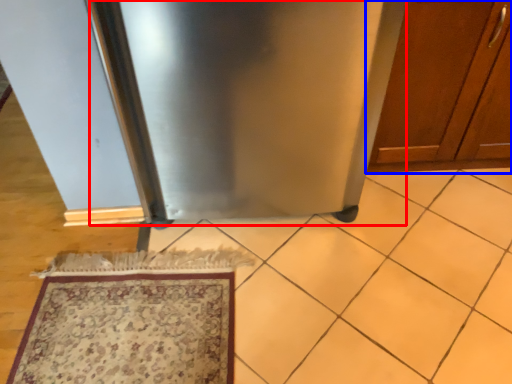
Question: Which point is further to the camera, appliance (highlighted by a red box) or cabinetry (highlighted by a blue box)?

Choices:
 (A) appliance
 (B) cabinetry

Answer: (B)